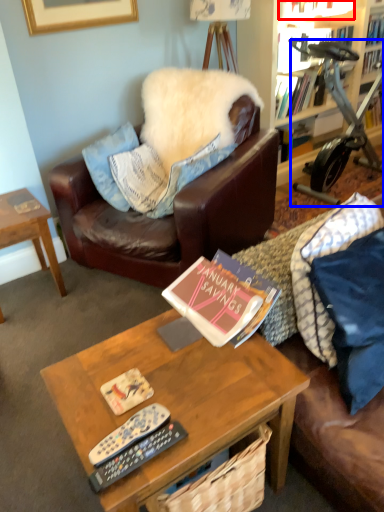
Question: Which point is further to the camera, book (highlighted by a red box) or stationary bicycle (highlighted by a blue box)?

Choices:
 (A) book
 (B) stationary bicycle

Answer: (A)